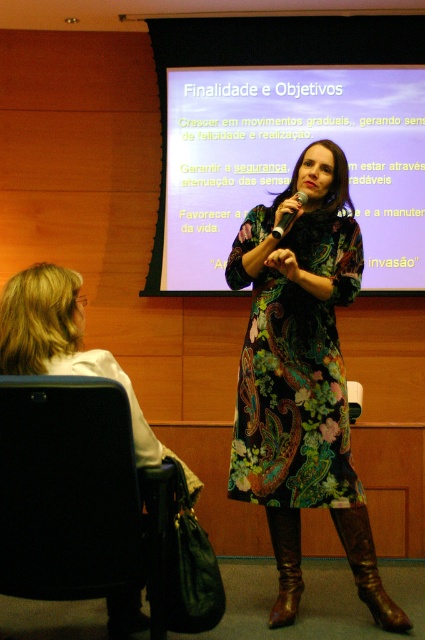
You are an event organizer setting up a conference room. You need to place a 12 feet long banner horizontally on the wall where the white matte projection screen at upper center is located. Can the banner fit without overlapping the screen?

The white matte projection screen at upper center is 13.39 feet away from the camera. However, the distance from the camera does not indicate the screen or wall width. Therefore, it is unclear if the 12 feet banner can fit without overlapping the screen based on the provided information.

You are an attendee in the conference room and want to take a photo of the presentation. You notice two points in the image at coordinates point (237, 212) and point (263, 413). Which point is closer to you when you take the photo?

Point (237, 212) is further to the viewer than point (263, 413), so the point closer to you is point (263, 413).